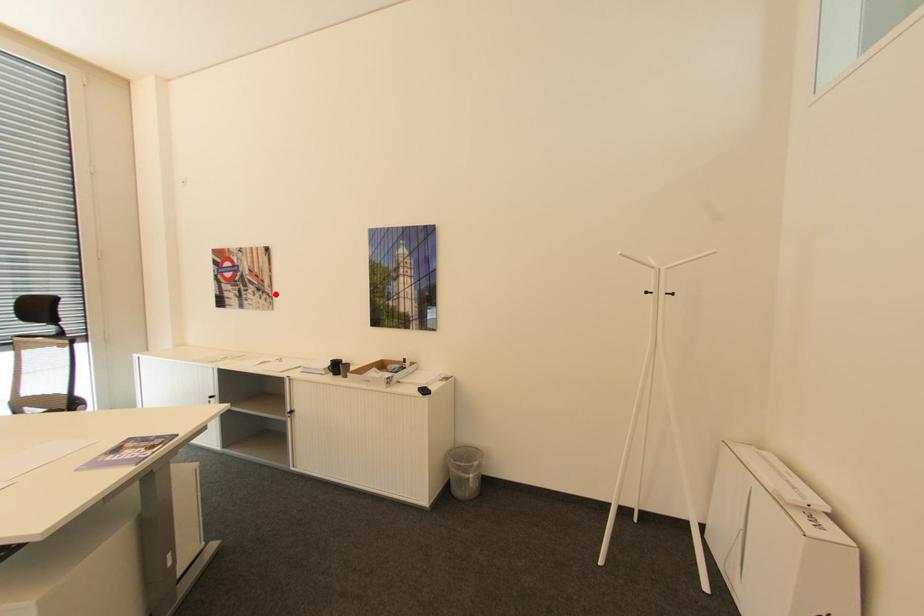
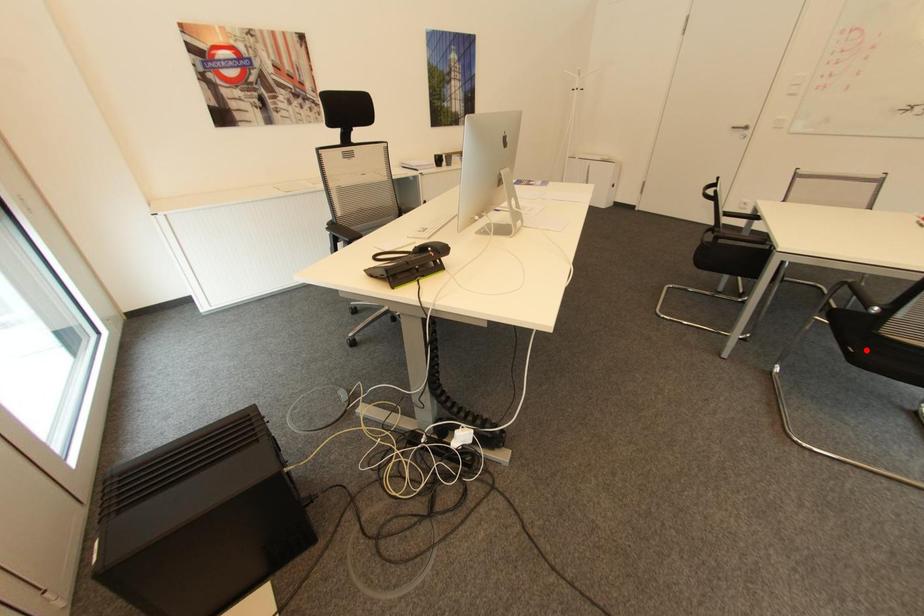
I am providing you with two images of the same scene from different viewpoints. A red point is marked on the first image and another point is marked on the second image. Do the highlighted points in image1 and image2 indicate the same real-world spot?

No